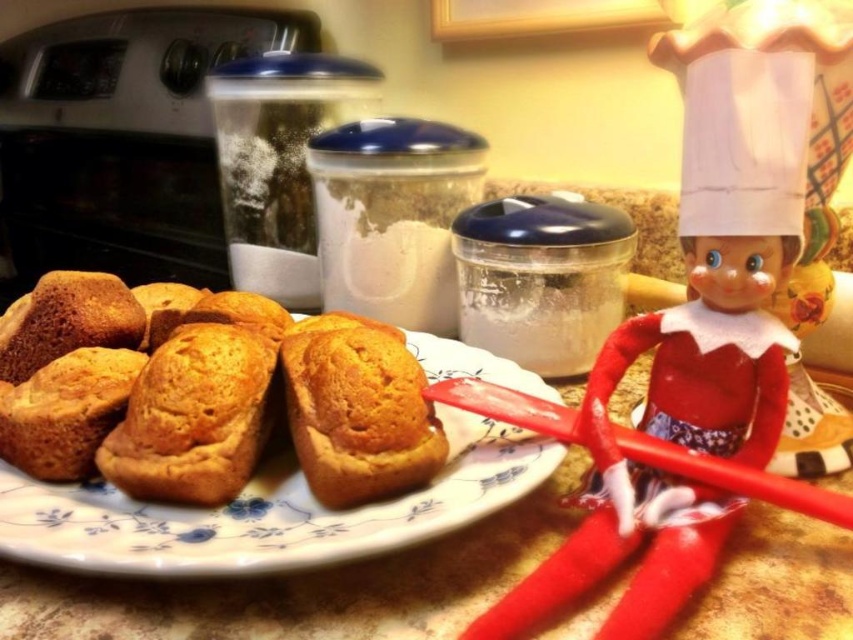
Who is lower down, golden-brown ceramic muffins at center-left or golden matte muffin at center?

golden-brown ceramic muffins at center-left is below.

Which is more to the right, golden-brown ceramic muffins at center-left or golden matte muffin at center?

golden matte muffin at center

Who is more forward, (405, 500) or (347, 444)?

Point (347, 444) is more forward.

The image size is (853, 640). Find the location of `golden-brown ceramic muffins at center-left`. golden-brown ceramic muffins at center-left is located at coordinates (267, 513).